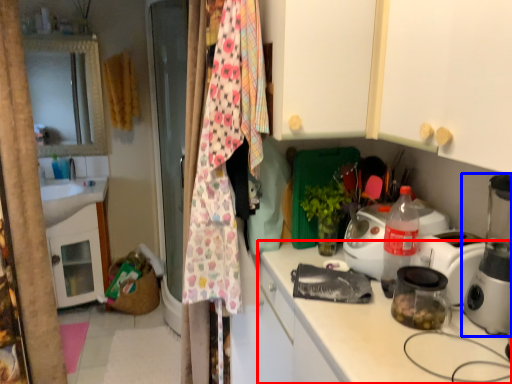
Question: Which of the following is the closest to the observer, countertop (highlighted by a red box) or home appliance (highlighted by a blue box)?

Choices:
 (A) countertop
 (B) home appliance

Answer: (A)